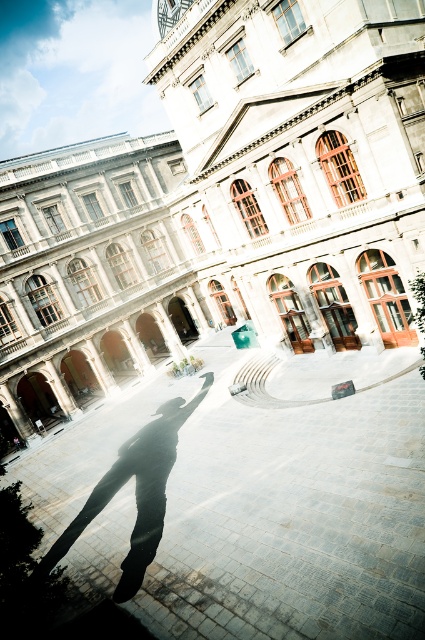
You are standing at the edge of the smooth stone pavement at center and want to reach the building entrance which is 7.64 meters away. If your walking speed is 1.2 meters per second, how many seconds will it take you to reach the entrance?

It will take approximately 6.36 seconds to reach the entrance, calculated by dividing the distance of 7.64 meters by the walking speed of 1.2 meters per second.

In the scene shown: You are standing in the courtyard and want to take a photo of the white stone building at center without the smooth stone pavement at center appearing in the frame. Is this possible given their positions?

The white stone building at center is above the smooth stone pavement at center, so you can angle your camera upwards to capture the building without including the pavement in the frame.

You are standing in the courtyard of the white stone building at center and want to take a photo of it. However, there is a black matte skateboard at center blocking your view. Can you move the skateboard to the side to get an unobstructed view of the building?

The white stone building at center is bigger than the black matte skateboard at center, so moving the skateboard to the side would allow you to get an unobstructed view of the building.